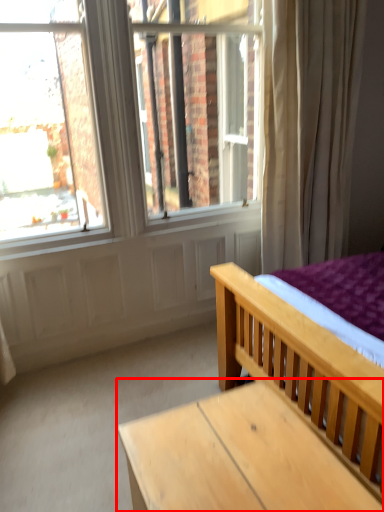
Question: From the image's perspective, where is table (annotated by the red box) located in relation to bed in the image?

Choices:
 (A) below
 (B) above

Answer: (A)